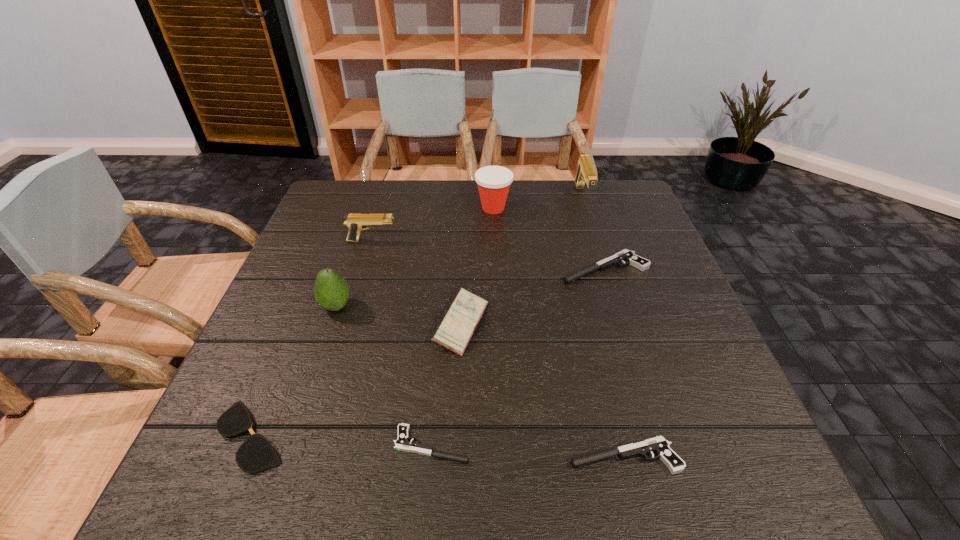
The height and width of the screenshot is (540, 960). Find the location of `blank area at the right edge`. blank area at the right edge is located at coordinates (621, 226).

At what (x,y) coordinates should I click in order to perform the action: click on vacant area at the far left corner of the desktop. Please return your answer as a coordinate pair (x, y). This screenshot has width=960, height=540. Looking at the image, I should click on click(x=345, y=221).

Image resolution: width=960 pixels, height=540 pixels. In the image, there is a desktop. Find the location of `free space at the far right corner`. free space at the far right corner is located at coordinates (636, 221).

I want to click on vacant space at the near right corner of the desktop, so click(759, 468).

Find the location of a particular element. This screenshot has height=540, width=960. vacant area between the third farthest pistol and the shortest pistol is located at coordinates (518, 356).

Identify the location of blank region between the spectacles and the third nearest pistol. (428, 352).

Locate an element on the screen. Image resolution: width=960 pixels, height=540 pixels. vacant point located between the avocado and the shortest pistol is located at coordinates (384, 375).

This screenshot has height=540, width=960. What are the coordinates of `unoccupied position between the red-orange Dixie cup and the tallest pistol` in the screenshot? It's located at (538, 202).

You are a GUI agent. You are given a task and a screenshot of the screen. Output one action in this format:
    pyautogui.click(x=<x>, y=<y>)
    Task: Click on the free spot between the diary and the avocado
    The width and height of the screenshot is (960, 540).
    Given the screenshot: What is the action you would take?
    pyautogui.click(x=398, y=315)

You are a GUI agent. You are given a task and a screenshot of the screen. Output one action in this format:
    pyautogui.click(x=<x>, y=<y>)
    Task: Click on the empty location between the Dixie cup and the sixth shortest object
    Image resolution: width=960 pixels, height=540 pixels.
    Given the screenshot: What is the action you would take?
    pyautogui.click(x=433, y=225)